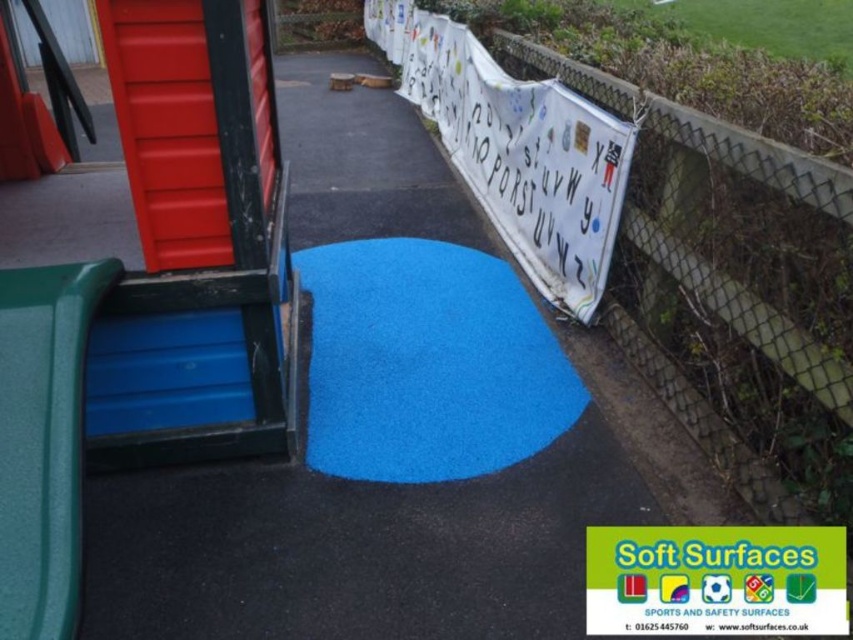
Question: Which point appears farthest from the camera in this image?

Choices:
 (A) (363, 388)
 (B) (55, 634)

Answer: (A)

Question: Which point appears closest to the camera in this image?

Choices:
 (A) (402, 468)
 (B) (42, 321)

Answer: (B)

Question: Is blue rubber mat at center positioned at the back of green textured slide at left?

Choices:
 (A) no
 (B) yes

Answer: (B)

Question: From the image, what is the correct spatial relationship of blue rubber mat at center in relation to green textured slide at left?

Choices:
 (A) below
 (B) above

Answer: (B)

Question: Is blue rubber mat at center to the left of green textured slide at left from the viewer's perspective?

Choices:
 (A) no
 (B) yes

Answer: (A)